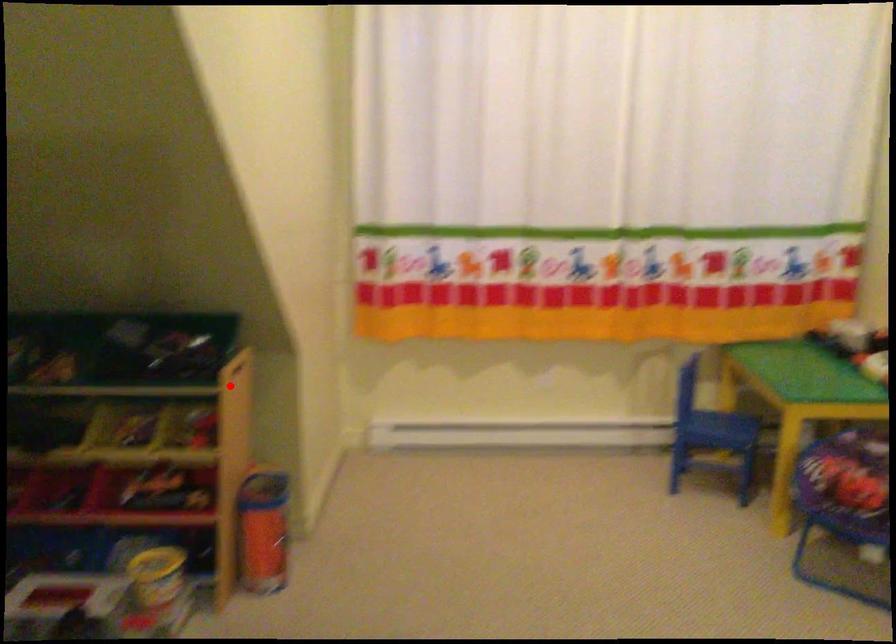
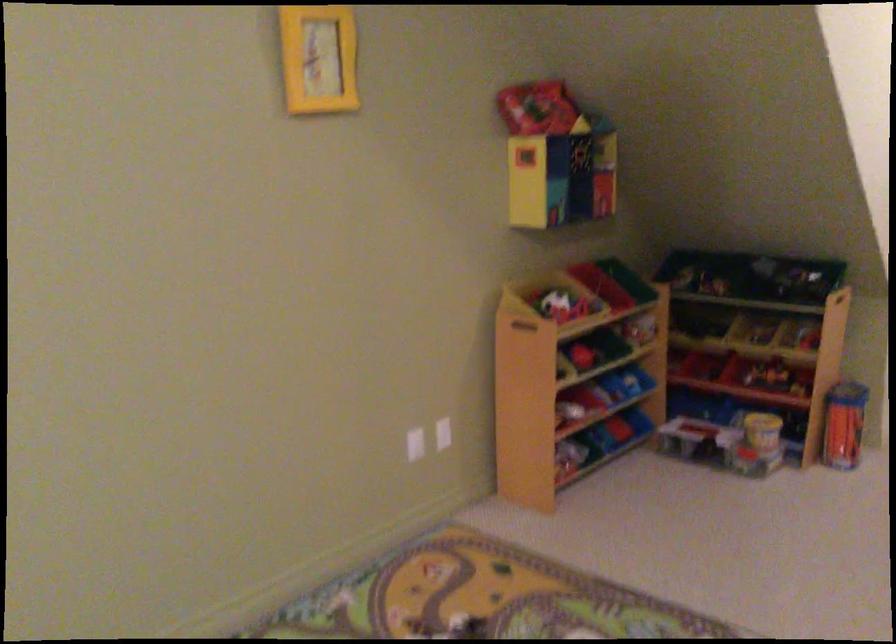
Where in the second image is the point corresponding to the highlighted location from the first image?

(839, 303)